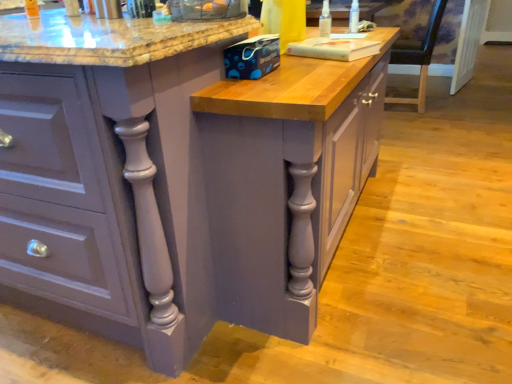
This screenshot has height=384, width=512. What do you see at coordinates (354, 17) in the screenshot?
I see `transparent plastic spray bottle at upper right, the 1th bottle in the back-to-front sequence` at bounding box center [354, 17].

The image size is (512, 384). What do you see at coordinates (108, 176) in the screenshot?
I see `matte gray cabinet at center` at bounding box center [108, 176].

At what (x,y) coordinates should I click in order to perform the action: click on clear plastic spray bottle at upper right, which ranks as the 1th bottle in left-to-right order. Please return your answer as a coordinate pair (x, y). This screenshot has height=384, width=512. Looking at the image, I should click on (325, 20).

The width and height of the screenshot is (512, 384). In the image, there is a transparent plastic spray bottle at upper right, which ranks as the 2th bottle in front-to-back order. In order to click on bottle below it (from the image's perspective) in this screenshot , I will do `click(325, 20)`.

In the scene shown: Is clear plastic spray bottle at upper right, the 2th bottle from the back, at the left side of transparent plastic spray bottle at upper right, which ranks as the 2th bottle in front-to-back order?

Yes, clear plastic spray bottle at upper right, the 2th bottle from the back, is to the left of transparent plastic spray bottle at upper right, which ranks as the 2th bottle in front-to-back order.

Is clear plastic spray bottle at upper right, arranged as the 2th bottle when viewed from the right, taller than transparent plastic spray bottle at upper right, the second bottle in the left-to-right sequence?

Incorrect, the height of clear plastic spray bottle at upper right, arranged as the 2th bottle when viewed from the right, is not larger of that of transparent plastic spray bottle at upper right, the second bottle in the left-to-right sequence.

Can you confirm if wooden chair at right is shorter than matte gray cabinet at center?

Yes.

Is wooden chair at right positioned far away from matte gray cabinet at center?

Absolutely, wooden chair at right is distant from matte gray cabinet at center.

From a real-world perspective, is wooden chair at right located beneath matte gray cabinet at center?

Yes, from a real-world perspective, wooden chair at right is below matte gray cabinet at center.

Between point (53, 136) and point (353, 29), which one is positioned behind?

The point (353, 29) is more distant.

From the image's perspective, would you say matte gray cabinet at center is shown under transparent plastic spray bottle at upper right, the 1th bottle in the back-to-front sequence?

Correct, matte gray cabinet at center appears lower than transparent plastic spray bottle at upper right, the 1th bottle in the back-to-front sequence, in the image.

Is transparent plastic spray bottle at upper right, the 1th bottle in the back-to-front sequence, facing away from matte gray cabinet at center?

Correct, transparent plastic spray bottle at upper right, the 1th bottle in the back-to-front sequence, is looking away from matte gray cabinet at center.

Which is nearer, (354, 29) or (50, 194)?

Point (354, 29) is positioned farther from the camera compared to point (50, 194).

From the picture: Considering the sizes of transparent plastic spray bottle at upper right, which ranks as the 2th bottle in front-to-back order, and matte gray cabinet at center in the image, is transparent plastic spray bottle at upper right, which ranks as the 2th bottle in front-to-back order, taller or shorter than matte gray cabinet at center?

Clearly, transparent plastic spray bottle at upper right, which ranks as the 2th bottle in front-to-back order, is shorter compared to matte gray cabinet at center.

How many degrees apart are the facing directions of transparent plastic spray bottle at upper right, the second bottle in the left-to-right sequence, and matte gray cabinet at center?

The angular difference between transparent plastic spray bottle at upper right, the second bottle in the left-to-right sequence, and matte gray cabinet at center is 1.08 degrees.

Is matte gray cabinet at center positioned far away from clear plastic spray bottle at upper right, the 2th bottle from the back?

matte gray cabinet at center is positioned a significant distance from clear plastic spray bottle at upper right, the 2th bottle from the back.

Is matte gray cabinet at center oriented away from clear plastic spray bottle at upper right, which ranks as the 1th bottle in left-to-right order?

No.

Can you confirm if matte gray cabinet at center is positioned to the right of clear plastic spray bottle at upper right, which ranks as the 1th bottle in left-to-right order?

In fact, matte gray cabinet at center is to the left of clear plastic spray bottle at upper right, which ranks as the 1th bottle in left-to-right order.

Can we say matte gray cabinet at center lies outside clear plastic spray bottle at upper right, which is the first bottle in front-to-back order?

matte gray cabinet at center lies outside clear plastic spray bottle at upper right, which is the first bottle in front-to-back order,'s area.

Is matte gray cabinet at center bigger or smaller than wooden chair at right?

matte gray cabinet at center is bigger than wooden chair at right.

Looking at this image, is matte gray cabinet at center inside or outside of wooden chair at right?

matte gray cabinet at center is not inside wooden chair at right, it's outside.

From a real-world perspective, is matte gray cabinet at center positioned above or below wooden chair at right?

matte gray cabinet at center is above wooden chair at right.

Is matte gray cabinet at center facing towards wooden chair at right?

No, matte gray cabinet at center is not turned towards wooden chair at right.

Is point (324, 19) positioned in front of point (443, 10)?

Yes, point (324, 19) is in front of point (443, 10).

Could you tell me if clear plastic spray bottle at upper right, which ranks as the 1th bottle in left-to-right order, is turned towards wooden chair at right?

No, clear plastic spray bottle at upper right, which ranks as the 1th bottle in left-to-right order, is not aimed at wooden chair at right.

Is clear plastic spray bottle at upper right, arranged as the 2th bottle when viewed from the right, far away from wooden chair at right?

clear plastic spray bottle at upper right, arranged as the 2th bottle when viewed from the right, is positioned a significant distance from wooden chair at right.

Is wooden chair at right surrounded by clear plastic spray bottle at upper right, the 2th bottle from the back?

No, wooden chair at right is not surrounded by clear plastic spray bottle at upper right, the 2th bottle from the back.

Where is `bottle directly beneath the transparent plastic spray bottle at upper right, marked as the first bottle in a right-to-left arrangement (from a real-world perspective)`? This screenshot has width=512, height=384. bottle directly beneath the transparent plastic spray bottle at upper right, marked as the first bottle in a right-to-left arrangement (from a real-world perspective) is located at coordinates (325, 20).

Identify the location of chair that appears on the right of matte gray cabinet at center. The width and height of the screenshot is (512, 384). (419, 57).

Looking at the image, which one is located closer to matte gray cabinet at center, clear plastic spray bottle at upper right, which ranks as the 1th bottle in left-to-right order, or transparent plastic spray bottle at upper right, the 1th bottle in the back-to-front sequence?

clear plastic spray bottle at upper right, which ranks as the 1th bottle in left-to-right order, is positioned closer to the anchor matte gray cabinet at center.

Which object lies further to the anchor point transparent plastic spray bottle at upper right, the 1th bottle in the back-to-front sequence, matte gray cabinet at center or wooden chair at right?

The object further to transparent plastic spray bottle at upper right, the 1th bottle in the back-to-front sequence, is wooden chair at right.

Based on their spatial positions, is wooden chair at right or matte gray cabinet at center closer to transparent plastic spray bottle at upper right, marked as the first bottle in a right-to-left arrangement?

matte gray cabinet at center is positioned closer to the anchor transparent plastic spray bottle at upper right, marked as the first bottle in a right-to-left arrangement.

When comparing their distances from wooden chair at right, does clear plastic spray bottle at upper right, arranged as the 2th bottle when viewed from the right, or transparent plastic spray bottle at upper right, marked as the first bottle in a right-to-left arrangement, seem further?

A: Among the two, clear plastic spray bottle at upper right, arranged as the 2th bottle when viewed from the right, is located further to wooden chair at right.

When comparing their distances from clear plastic spray bottle at upper right, arranged as the 2th bottle when viewed from the right, does transparent plastic spray bottle at upper right, which ranks as the 2th bottle in front-to-back order, or matte gray cabinet at center seem further?

Among the two, matte gray cabinet at center is located further to clear plastic spray bottle at upper right, arranged as the 2th bottle when viewed from the right.

Which object lies nearer to the anchor point transparent plastic spray bottle at upper right, marked as the first bottle in a right-to-left arrangement, wooden chair at right or clear plastic spray bottle at upper right, arranged as the 2th bottle when viewed from the right?

clear plastic spray bottle at upper right, arranged as the 2th bottle when viewed from the right, is closer to transparent plastic spray bottle at upper right, marked as the first bottle in a right-to-left arrangement.

Looking at the image, which one is located closer to transparent plastic spray bottle at upper right, the 1th bottle in the back-to-front sequence, clear plastic spray bottle at upper right, which is the first bottle in front-to-back order, or wooden chair at right?

The object closer to transparent plastic spray bottle at upper right, the 1th bottle in the back-to-front sequence, is clear plastic spray bottle at upper right, which is the first bottle in front-to-back order.

Estimate the real-world distances between objects in this image. Which object is further from clear plastic spray bottle at upper right, which is the first bottle in front-to-back order, transparent plastic spray bottle at upper right, marked as the first bottle in a right-to-left arrangement, or wooden chair at right?

wooden chair at right is positioned further to the anchor clear plastic spray bottle at upper right, which is the first bottle in front-to-back order.

Where is `bottle between clear plastic spray bottle at upper right, which ranks as the 1th bottle in left-to-right order, and wooden chair at right from front to back`? The width and height of the screenshot is (512, 384). bottle between clear plastic spray bottle at upper right, which ranks as the 1th bottle in left-to-right order, and wooden chair at right from front to back is located at coordinates (354, 17).

You are a GUI agent. You are given a task and a screenshot of the screen. Output one action in this format:
    pyautogui.click(x=<x>, y=<y>)
    Task: Click on the bottle between matte gray cabinet at center and transparent plastic spray bottle at upper right, the 1th bottle in the back-to-front sequence, along the z-axis
    The image size is (512, 384).
    Given the screenshot: What is the action you would take?
    pyautogui.click(x=325, y=20)